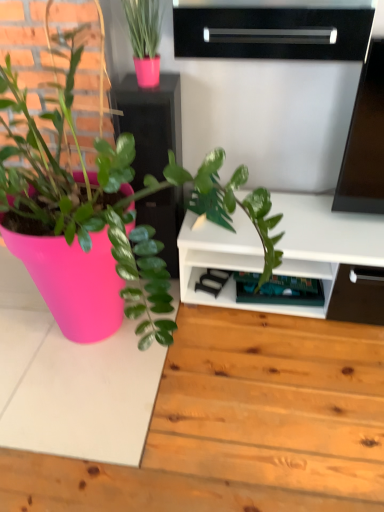
Question: Is black glossy shelf at upper center, which is the 2th shelf from back to front, taller or shorter than matte black cabinet at upper center?

Choices:
 (A) short
 (B) tall

Answer: (A)

Question: Is black glossy shelf at upper center, placed as the second shelf when sorted from bottom to top, bigger or smaller than matte black cabinet at upper center?

Choices:
 (A) big
 (B) small

Answer: (B)

Question: Which of these objects is positioned closest to the black glossy shelf at upper center, which is the 2th shelf from back to front?

Choices:
 (A) green plastic shelf at lower center, the first shelf when ordered from back to front
 (B) matte black cabinet at upper center

Answer: (B)

Question: Which is nearer to the matte black cabinet at upper center?

Choices:
 (A) black glossy shelf at upper center, placed as the 1th shelf when sorted from top to bottom
 (B) green plastic shelf at lower center, positioned as the 1th shelf in bottom-to-top order

Answer: (A)